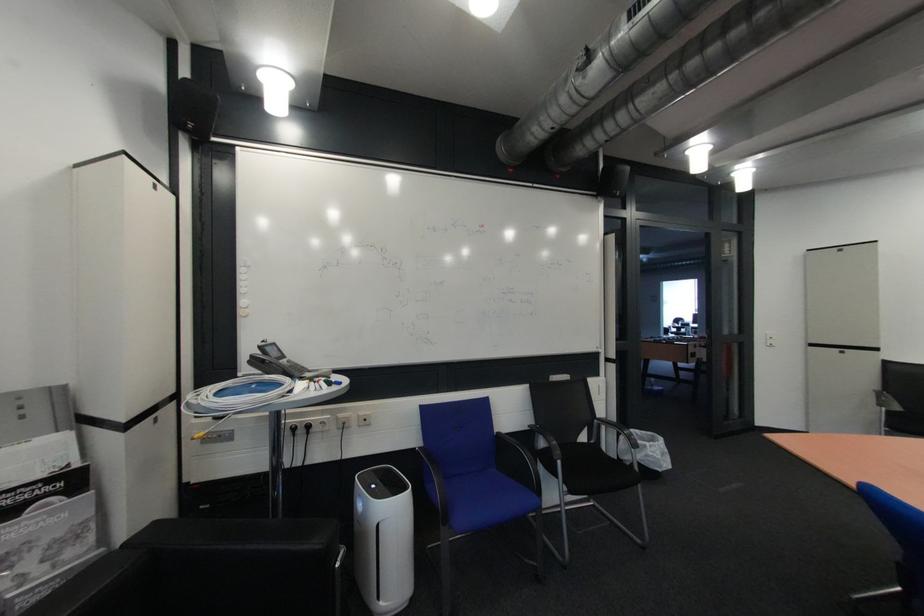
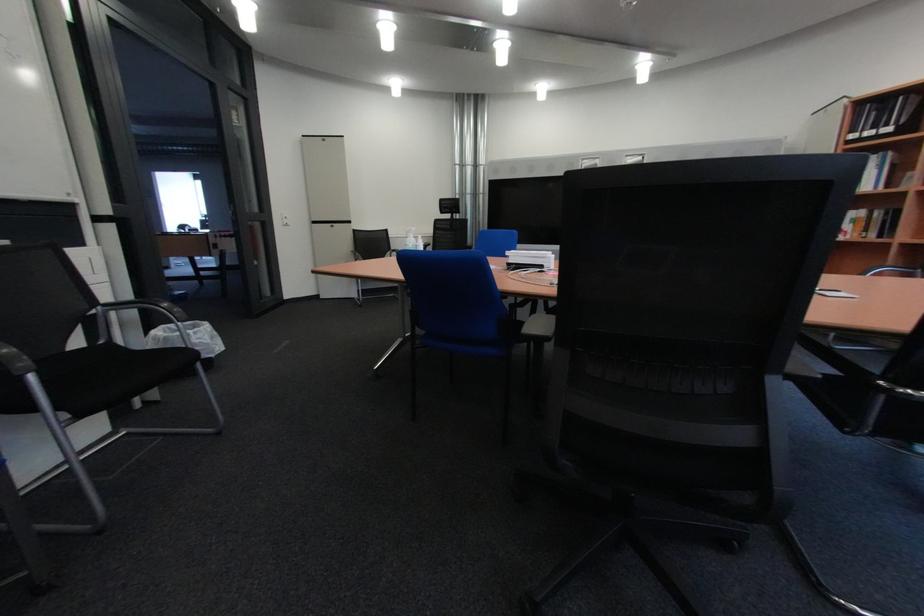
Question: The camera is either moving clockwise (left) or counter-clockwise (right) around the object. The first image is from the beginning of the video and the second image is from the end. Is the camera moving left or right when shooting the video?

Choices:
 (A) Left
 (B) Right

Answer: (A)